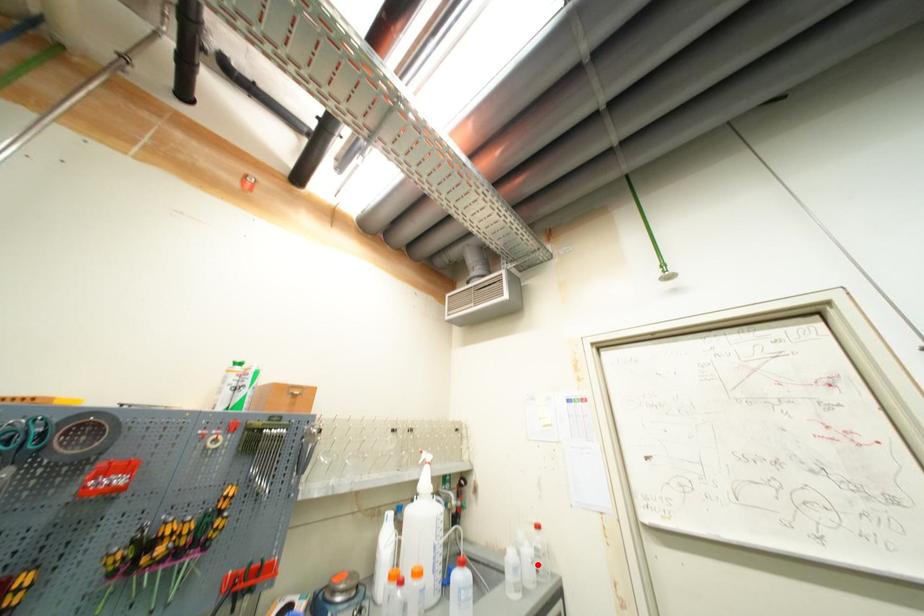
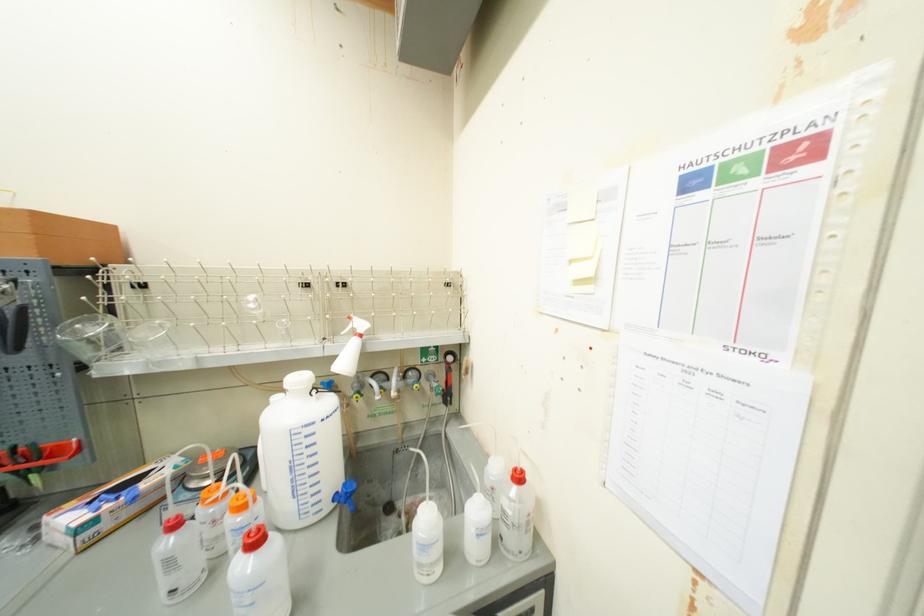
The point at the highlighted location is marked in the first image. Where is the corresponding point in the second image?

(483, 538)